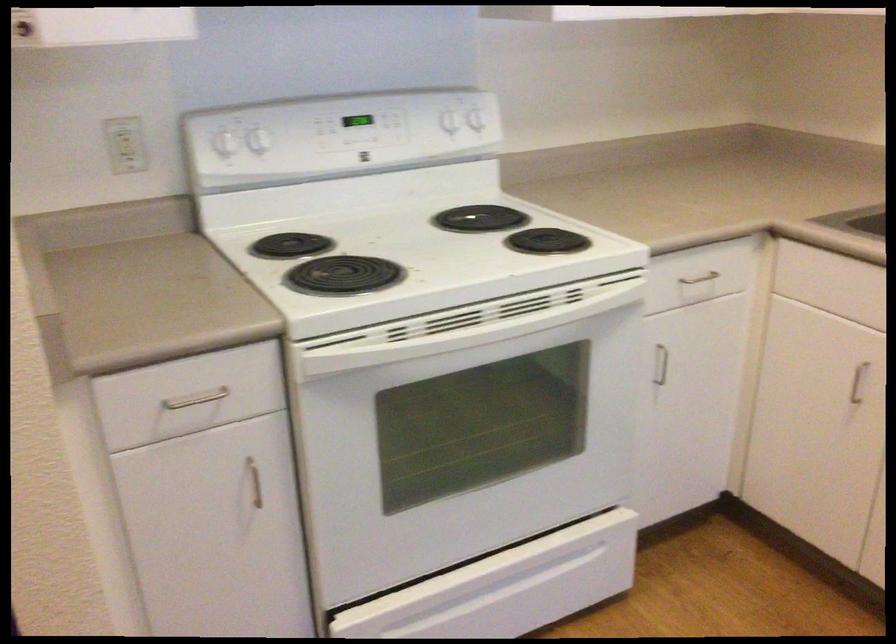
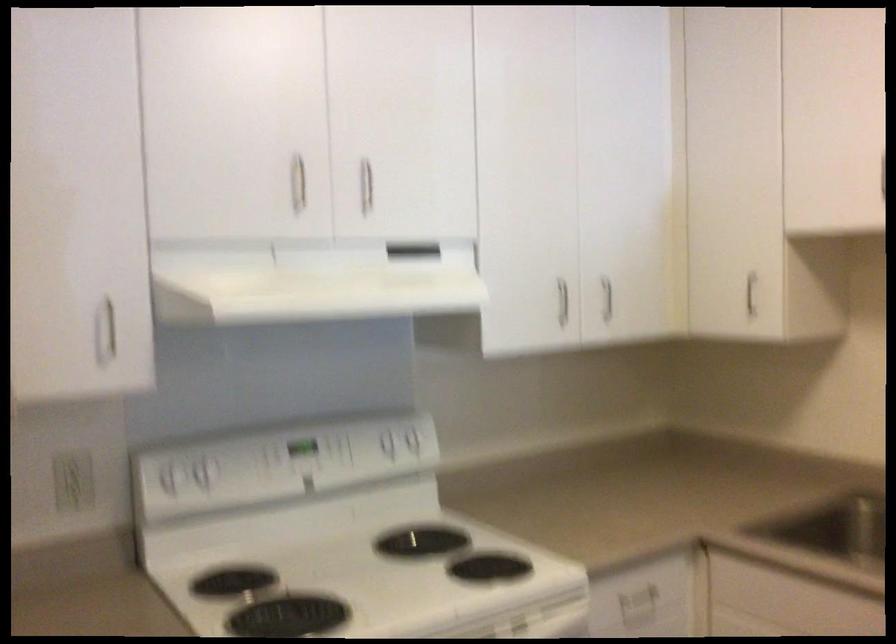
Where in the second image is the point corresponding to pixel 133 142 from the first image?

(73, 480)